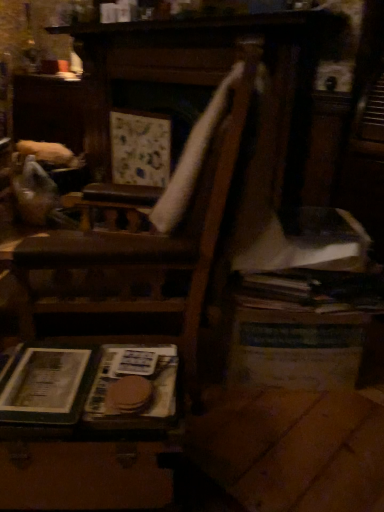
Locate an element on the screen. brown paper at lower left, the first paperback book positioned from the right is located at coordinates (133, 388).

This screenshot has width=384, height=512. What do you see at coordinates (48, 386) in the screenshot?
I see `hardcover book at lower left, acting as the first paperback book starting from the left` at bounding box center [48, 386].

The height and width of the screenshot is (512, 384). What do you see at coordinates (86, 426) in the screenshot?
I see `wooden suitcase at lower left, which ranks as the second table in back-to-front order` at bounding box center [86, 426].

At what (x,y) coordinates should I click in order to perform the action: click on wooden table at lower right, the second table viewed from the front. Please return your answer as a coordinate pair (x, y). Looking at the image, I should click on [296, 348].

From the image's perspective, which object appears higher, wooden suitcase at lower left, which ranks as the second table in back-to-front order, or brown paper at lower left, the second paperback book viewed from the left?

brown paper at lower left, the second paperback book viewed from the left, from the image's perspective.

Is wooden suitcase at lower left, which ranks as the second table in back-to-front order, spatially inside brown paper at lower left, the second paperback book viewed from the left, or outside of it?

wooden suitcase at lower left, which ranks as the second table in back-to-front order, exists outside the volume of brown paper at lower left, the second paperback book viewed from the left.

Is the surface of wooden suitcase at lower left, which ranks as the second table in back-to-front order, in direct contact with brown paper at lower left, the second paperback book viewed from the left?

Yes, wooden suitcase at lower left, which ranks as the second table in back-to-front order, is right next to brown paper at lower left, the second paperback book viewed from the left, and making contact.

From a real-world perspective, between brown paper at lower left, the first paperback book positioned from the right, and wooden table at lower right, the second table when ordered from left to right, who is vertically higher?

From a 3D spatial view, brown paper at lower left, the first paperback book positioned from the right, is above.

How distant is brown paper at lower left, the second paperback book viewed from the left, from wooden table at lower right, the second table viewed from the front?

brown paper at lower left, the second paperback book viewed from the left, is 19.40 inches away from wooden table at lower right, the second table viewed from the front.

Between brown paper at lower left, the second paperback book viewed from the left, and wooden table at lower right, the second table viewed from the front, which one appears on the right side from the viewer's perspective?

Positioned to the right is wooden table at lower right, the second table viewed from the front.

Is brown paper at lower left, the second paperback book viewed from the left, shorter than wooden table at lower right, marked as the 1th table in a back-to-front arrangement?

Yes, brown paper at lower left, the second paperback book viewed from the left, is shorter than wooden table at lower right, marked as the 1th table in a back-to-front arrangement.

How far apart are wooden suitcase at lower left, which ranks as the second table in back-to-front order, and hardcover book at lower left, which appears as the second paperback book when viewed from the right?

wooden suitcase at lower left, which ranks as the second table in back-to-front order, is 3.61 inches away from hardcover book at lower left, which appears as the second paperback book when viewed from the right.

Considering the points (61, 357) and (75, 377), which point is in front, point (61, 357) or point (75, 377)?

The point (75, 377) is more forward.

Is wooden suitcase at lower left, the 1th table from the front, thinner than hardcover book at lower left, which appears as the second paperback book when viewed from the right?

Incorrect, the width of wooden suitcase at lower left, the 1th table from the front, is not less than that of hardcover book at lower left, which appears as the second paperback book when viewed from the right.

Does wooden suitcase at lower left, which ranks as the second table in back-to-front order, have a greater height compared to hardcover book at lower left, which appears as the second paperback book when viewed from the right?

Correct, wooden suitcase at lower left, which ranks as the second table in back-to-front order, is much taller as hardcover book at lower left, which appears as the second paperback book when viewed from the right.

Which is correct: brown paper at lower left, the second paperback book viewed from the left, is inside hardcover book at lower left, acting as the first paperback book starting from the left, or outside of it?

brown paper at lower left, the second paperback book viewed from the left, is not inside hardcover book at lower left, acting as the first paperback book starting from the left, it's outside.

Is the surface of brown paper at lower left, the first paperback book positioned from the right, in direct contact with hardcover book at lower left, acting as the first paperback book starting from the left?

There is a gap between brown paper at lower left, the first paperback book positioned from the right, and hardcover book at lower left, acting as the first paperback book starting from the left.

Is brown paper at lower left, the first paperback book positioned from the right, facing away from hardcover book at lower left, acting as the first paperback book starting from the left?

No, brown paper at lower left, the first paperback book positioned from the right,'s orientation is not away from hardcover book at lower left, acting as the first paperback book starting from the left.

How different are the orientations of brown paper at lower left, the second paperback book viewed from the left, and hardcover book at lower left, acting as the first paperback book starting from the left, in degrees?

1.27 degrees separate the facing orientations of brown paper at lower left, the second paperback book viewed from the left, and hardcover book at lower left, acting as the first paperback book starting from the left.

Is wooden table at lower right, arranged as the first table when viewed from the right, looking in the opposite direction of brown paper at lower left, the first paperback book positioned from the right?

No, wooden table at lower right, arranged as the first table when viewed from the right,'s orientation is not away from brown paper at lower left, the first paperback book positioned from the right.

The height and width of the screenshot is (512, 384). Identify the location of paperback book that is the 1st object above the wooden table at lower right, the second table viewed from the front (from a real-world perspective). (133, 388).

From the image's perspective, which is above, hardcover book at lower left, which appears as the second paperback book when viewed from the right, or wooden table at lower right, the second table when ordered from left to right?

wooden table at lower right, the second table when ordered from left to right, is shown above in the image.

Which is in front, point (49, 350) or point (325, 352)?

The point (49, 350) is in front.

Which paperback book is the 2nd one when counting from the left side of the wooden table at lower right, marked as the 1th table in a back-to-front arrangement? Please provide its 2D coordinates.

[(48, 386)]

Which of these two, brown paper at lower left, the second paperback book viewed from the left, or wooden suitcase at lower left, the second table from the right, is thinner?

Thinner between the two is brown paper at lower left, the second paperback book viewed from the left.

Considering the sizes of brown paper at lower left, the first paperback book positioned from the right, and wooden suitcase at lower left, which is counted as the 1th table, starting from the left, in the image, is brown paper at lower left, the first paperback book positioned from the right, bigger or smaller than wooden suitcase at lower left, which is counted as the 1th table, starting from the left,?

brown paper at lower left, the first paperback book positioned from the right, is smaller than wooden suitcase at lower left, which is counted as the 1th table, starting from the left.

In the scene shown: Could you tell me if brown paper at lower left, the second paperback book viewed from the left, is turned towards wooden suitcase at lower left, the second table from the right?

No, brown paper at lower left, the second paperback book viewed from the left, is not oriented towards wooden suitcase at lower left, the second table from the right.

Can we say brown paper at lower left, the second paperback book viewed from the left, lies outside wooden suitcase at lower left, which ranks as the second table in back-to-front order?

Actually, brown paper at lower left, the second paperback book viewed from the left, is at least partially inside wooden suitcase at lower left, which ranks as the second table in back-to-front order.

Where is `table below the brown paper at lower left, the first paperback book positioned from the right (from the image's perspective)`? table below the brown paper at lower left, the first paperback book positioned from the right (from the image's perspective) is located at coordinates (86, 426).

Identify the location of the 1st table positioned below the brown paper at lower left, the second paperback book viewed from the left (from a real-world perspective). This screenshot has width=384, height=512. (296, 348).

From the picture: Considering their positions, is wooden suitcase at lower left, which is counted as the 1th table, starting from the left, positioned further to hardcover book at lower left, acting as the first paperback book starting from the left, than brown paper at lower left, the first paperback book positioned from the right?

brown paper at lower left, the first paperback book positioned from the right.

When comparing their distances from wooden suitcase at lower left, which ranks as the second table in back-to-front order, does hardcover book at lower left, which appears as the second paperback book when viewed from the right, or brown paper at lower left, the first paperback book positioned from the right, seem further?

Among the two, hardcover book at lower left, which appears as the second paperback book when viewed from the right, is located further to wooden suitcase at lower left, which ranks as the second table in back-to-front order.

From the image, which object appears to be farther from hardcover book at lower left, acting as the first paperback book starting from the left, brown paper at lower left, the first paperback book positioned from the right, or wooden suitcase at lower left, which is counted as the 1th table, starting from the left?

brown paper at lower left, the first paperback book positioned from the right, lies further to hardcover book at lower left, acting as the first paperback book starting from the left, than the other object.

Looking at the image, which one is located further to hardcover book at lower left, acting as the first paperback book starting from the left, wooden suitcase at lower left, which is counted as the 1th table, starting from the left, or wooden table at lower right, arranged as the first table when viewed from the right?

wooden table at lower right, arranged as the first table when viewed from the right, lies further to hardcover book at lower left, acting as the first paperback book starting from the left, than the other object.

Looking at the image, which one is located closer to wooden table at lower right, the second table viewed from the front, brown paper at lower left, the second paperback book viewed from the left, or wooden suitcase at lower left, which is counted as the 1th table, starting from the left?

Among the two, brown paper at lower left, the second paperback book viewed from the left, is located nearer to wooden table at lower right, the second table viewed from the front.

Looking at this image, based on their spatial positions, is brown paper at lower left, the second paperback book viewed from the left, or hardcover book at lower left, acting as the first paperback book starting from the left, further from wooden suitcase at lower left, which ranks as the second table in back-to-front order?

hardcover book at lower left, acting as the first paperback book starting from the left, is positioned further to the anchor wooden suitcase at lower left, which ranks as the second table in back-to-front order.

When comparing their distances from hardcover book at lower left, which appears as the second paperback book when viewed from the right, does wooden table at lower right, the second table viewed from the front, or wooden suitcase at lower left, the 1th table from the front, seem closer?

wooden suitcase at lower left, the 1th table from the front, is closer to hardcover book at lower left, which appears as the second paperback book when viewed from the right.

Based on their spatial positions, is hardcover book at lower left, which appears as the second paperback book when viewed from the right, or wooden table at lower right, the second table when ordered from left to right, further from brown paper at lower left, the first paperback book positioned from the right?

The object further to brown paper at lower left, the first paperback book positioned from the right, is wooden table at lower right, the second table when ordered from left to right.

The height and width of the screenshot is (512, 384). I want to click on paperback book situated between hardcover book at lower left, which appears as the second paperback book when viewed from the right, and wooden table at lower right, marked as the 1th table in a back-to-front arrangement, from left to right, so click(133, 388).

This screenshot has width=384, height=512. I want to click on table between hardcover book at lower left, acting as the first paperback book starting from the left, and wooden table at lower right, marked as the 1th table in a back-to-front arrangement, so click(86, 426).

At what (x,y) coordinates should I click in order to perform the action: click on paperback book between wooden suitcase at lower left, which is counted as the 1th table, starting from the left, and wooden table at lower right, the second table when ordered from left to right, from left to right. Please return your answer as a coordinate pair (x, y). Looking at the image, I should click on (133, 388).

You are a GUI agent. You are given a task and a screenshot of the screen. Output one action in this format:
    pyautogui.click(x=<x>, y=<y>)
    Task: Click on the table between hardcover book at lower left, acting as the first paperback book starting from the left, and brown paper at lower left, the second paperback book viewed from the left, in the horizontal direction
    
    Given the screenshot: What is the action you would take?
    pyautogui.click(x=86, y=426)